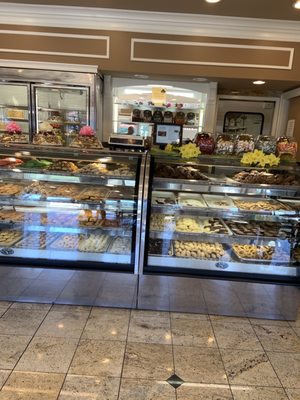
You are a GUI agent. You are given a task and a screenshot of the screen. Output one action in this format:
    pyautogui.click(x=<x>, y=<y>)
    Task: Click on the fridge
    Image resolution: width=300 pixels, height=400 pixels.
    Given the screenshot: What is the action you would take?
    pyautogui.click(x=47, y=103)